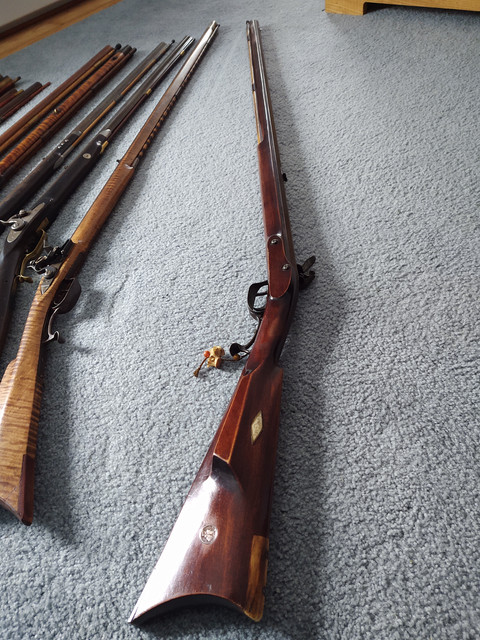
Find the location of a particular element. This screenshot has width=480, height=640. screws is located at coordinates (284, 268).